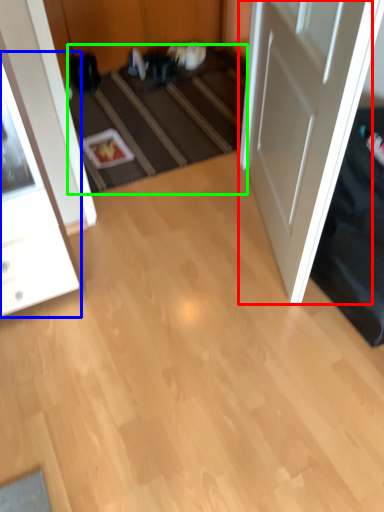
Question: Which is nearer to the door (highlighted by a red box)? cabinetry (highlighted by a blue box) or stair (highlighted by a green box).

Choices:
 (A) cabinetry
 (B) stair

Answer: (B)